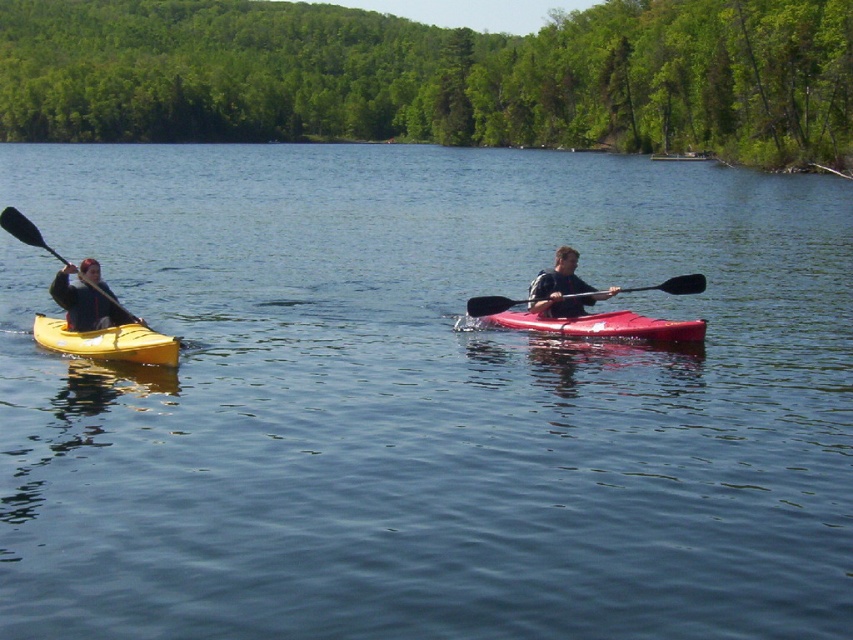
Which of these two, black rubber paddle at right or black rubber paddle at left, stands shorter?

With less height is black rubber paddle at right.

Does point (689, 289) lie in front of point (15, 236)?

That is False.

What do you see at coordinates (676, 284) in the screenshot? This screenshot has height=640, width=853. I see `black rubber paddle at right` at bounding box center [676, 284].

Where is `black rubber paddle at right`? Image resolution: width=853 pixels, height=640 pixels. black rubber paddle at right is located at coordinates (676, 284).

Does point (38, 323) lie behind point (677, 289)?

No, (38, 323) is closer to viewer.

Is the position of matte yellow kayak at left more distant than that of black rubber paddle at right?

No, matte yellow kayak at left is closer to the viewer.

This screenshot has height=640, width=853. In order to click on matte yellow kayak at left in this screenshot , I will do `click(107, 340)`.

Between point (100, 282) and point (563, 259), which one is positioned in front?

Positioned in front is point (100, 282).

Is matte black jacket at left to the right of matte black kayak at right from the viewer's perspective?

Incorrect, matte black jacket at left is not on the right side of matte black kayak at right.

You are a GUI agent. You are given a task and a screenshot of the screen. Output one action in this format:
    pyautogui.click(x=<x>, y=<y>)
    Task: Click on the matte black jacket at left
    This screenshot has width=853, height=640.
    Given the screenshot: What is the action you would take?
    pyautogui.click(x=86, y=300)

At what (x,y) coordinates should I click in order to perform the action: click on matte black jacket at left. Please return your answer as a coordinate pair (x, y). Looking at the image, I should click on (86, 300).